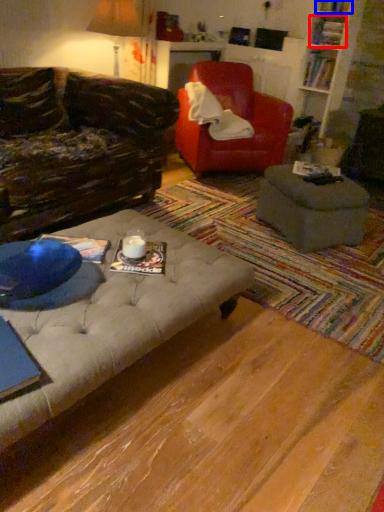
Question: Which object appears farthest to the camera in this image, book (highlighted by a red box) or book (highlighted by a blue box)?

Choices:
 (A) book
 (B) book

Answer: (A)